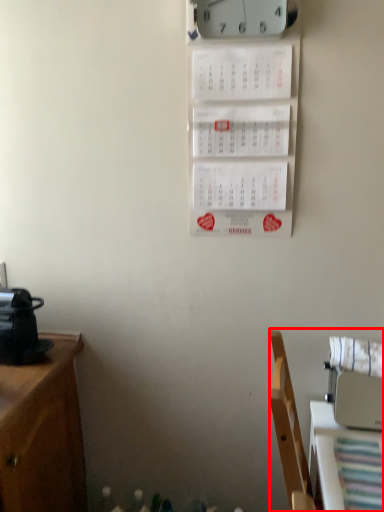
Question: From the image's perspective, where is furniture (annotated by the red box) located relative to clock?

Choices:
 (A) above
 (B) below

Answer: (B)